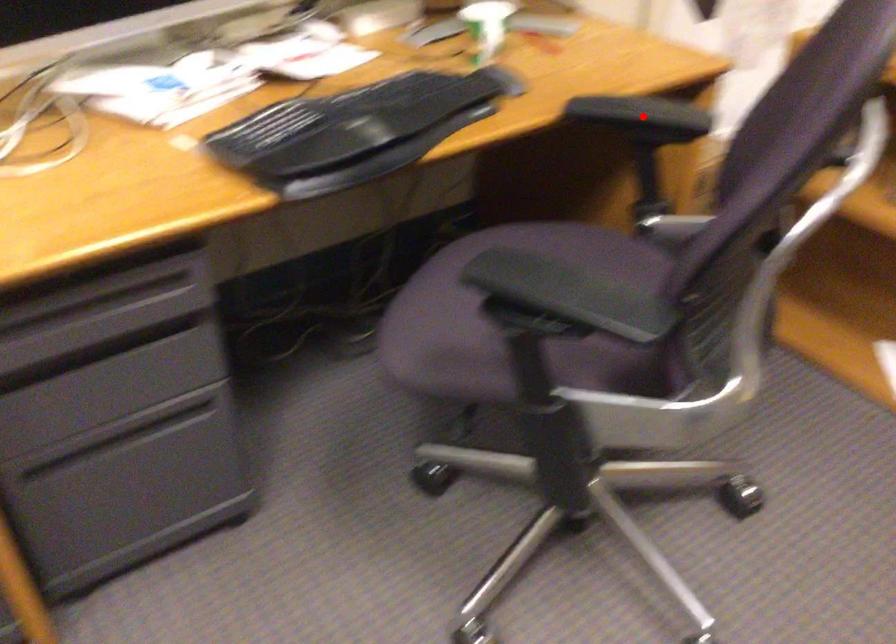
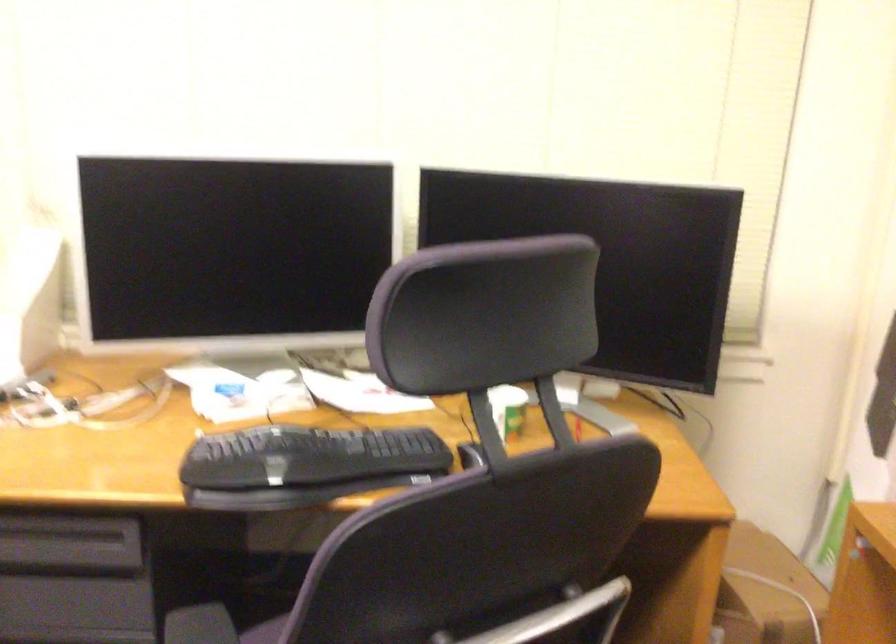
Question: I am providing you with two images of the same scene from different viewpoints. A red point is marked on the first image. Is the red point's position out of view in image 2?

Choices:
 (A) Yes
 (B) No

Answer: (A)